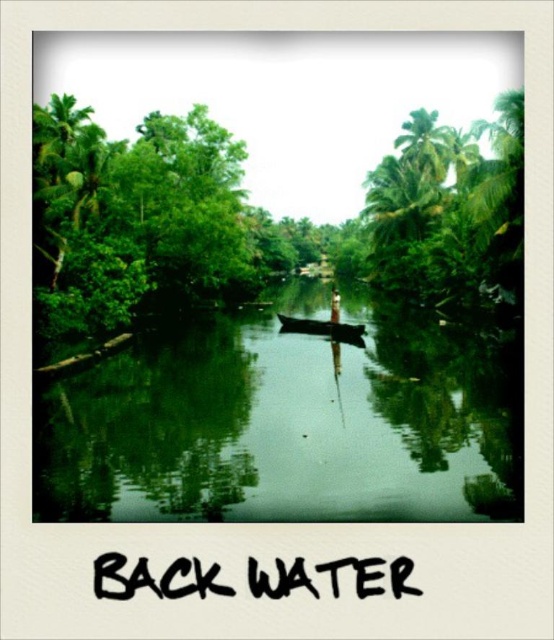
Is green leafy tree at left bigger than black wood canoe at center?

Indeed, green leafy tree at left has a larger size compared to black wood canoe at center.

Which is more to the left, green leafy tree at left or black wood canoe at center?

Positioned to the left is green leafy tree at left.

This screenshot has width=554, height=640. Find the location of `green leafy tree at left`. green leafy tree at left is located at coordinates (137, 216).

Can you confirm if green smooth water at center is positioned to the left of green leafy tree at upper right?

Indeed, green smooth water at center is positioned on the left side of green leafy tree at upper right.

Is green smooth water at center bigger than green leafy tree at upper right?

No.

Does point (393, 460) lie behind point (450, 284)?

No.

Locate an element on the screen. green smooth water at center is located at coordinates (284, 426).

Locate an element on the screen. green smooth water at center is located at coordinates point(284,426).

Does green smooth water at center have a lesser height compared to black wood canoe at center?

Incorrect, green smooth water at center's height does not fall short of black wood canoe at center's.

What do you see at coordinates (284, 426) in the screenshot?
I see `green smooth water at center` at bounding box center [284, 426].

Identify the location of green smooth water at center. This screenshot has height=640, width=554. (284, 426).